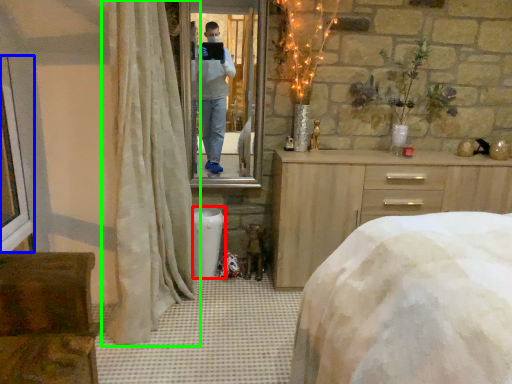
Question: Which object is the closest to the trash bin/can (highlighted by a red box)? Choose among these: window frame (highlighted by a blue box) or curtain (highlighted by a green box).

Choices:
 (A) window frame
 (B) curtain

Answer: (B)